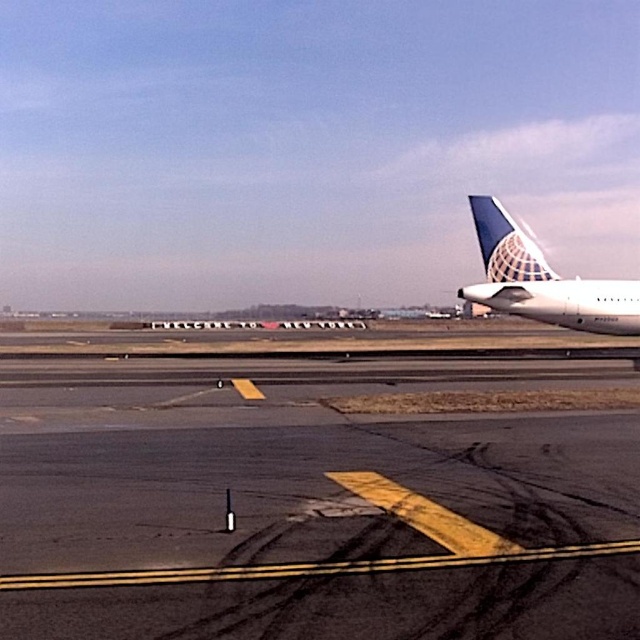
From the picture: You are a pilot approaching the airport runway. You notice the black asphalt tarmac at center and the blue textured tail fin at right in your view. Which object appears taller from your perspective?

The blue textured tail fin at right appears taller than the black asphalt tarmac at center because the description states that the black asphalt tarmac at center is not as tall as blue textured tail fin at right.

You are an airport maintenance worker needing to access the white glossy airplane at right and the blue textured tail fin at right for inspection. Given that your ladder is 2 meters wide, can you safely place it between these two objects without touching them?

The white glossy airplane at right is thinner than the blue textured tail fin at right. Since the airplane is thinner, the space between them might be narrower. However, without specific distance information between the two objects, it is impossible to determine if the 2m wide ladder can fit safely. Additional measurements are needed.

You are an airport worker needing to place a safety cone between the black asphalt tarmac at center and the white glossy airplane at right. Based on their positions, which object should the cone be closer to?

The black asphalt tarmac at center is positioned on the left side of the white glossy airplane at right, so the safety cone should be placed closer to the black asphalt tarmac at center to ensure it is between them.